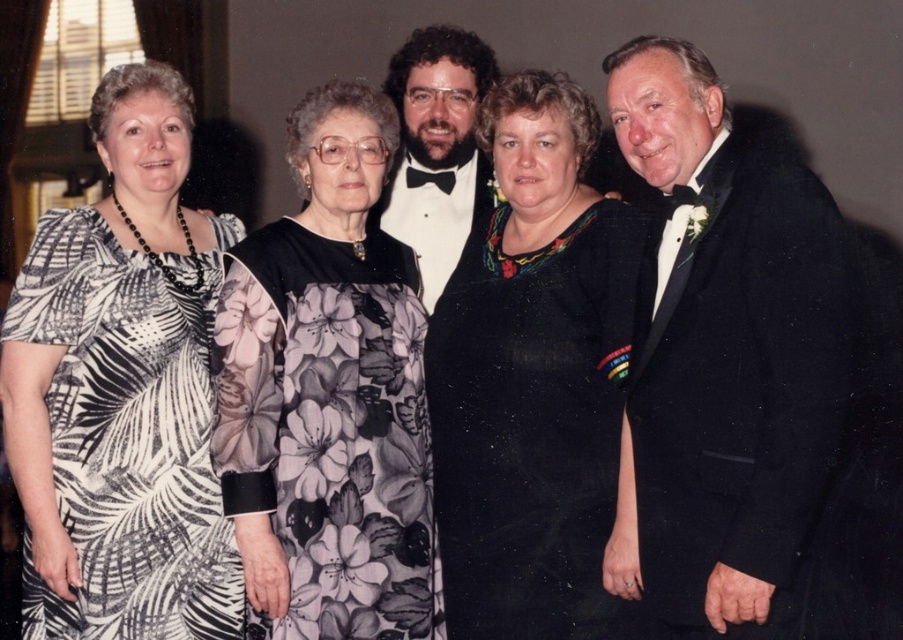
You are standing in front of the group photo and need to identify the positions of the black wool suit at right and the black matte dress at center. Which one is located to the right of the other?

The black wool suit at right is to the right of the black matte dress at center.

From the picture: You are a photographer adjusting the lighting for a group photo. The printed fabric dress at left and the black satin tuxedo at center are two focal points. If your spotlight has a range of 1 meter, can it illuminate both focal points simultaneously?

The printed fabric dress at left is 1.08 meters away from the black satin tuxedo at center. Since the spotlight has a range of 1 meter, it cannot illuminate both focal points at the same time because the distance between them exceeds the spotlight range.